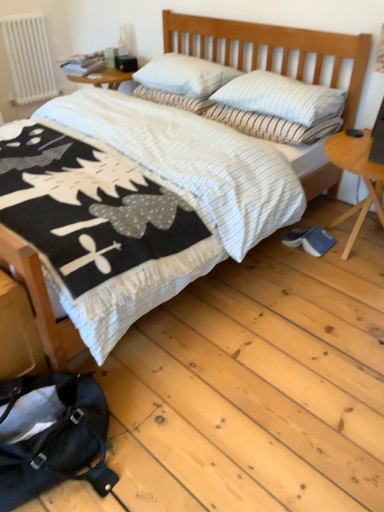
Question: In which direction should I rotate to look at white striped pillow at center, marked as the 1th pillow in a top-to-bottom arrangement?

Choices:
 (A) left
 (B) right

Answer: (A)

Question: Is white striped pillow at upper center, arranged as the third pillow when viewed from the top, positioned in front of white striped pillow at center, placed as the fourth pillow when sorted from bottom to top?

Choices:
 (A) yes
 (B) no

Answer: (A)

Question: Can you confirm if white striped pillow at upper center, arranged as the third pillow when viewed from the top, is positioned to the left of white striped pillow at center, placed as the fourth pillow when sorted from bottom to top?

Choices:
 (A) yes
 (B) no

Answer: (B)

Question: Is white striped pillow at upper center, which ranks as the second pillow in bottom-to-top order, smaller than white striped pillow at center, marked as the 1th pillow in a top-to-bottom arrangement?

Choices:
 (A) yes
 (B) no

Answer: (A)

Question: Is white striped pillow at upper center, which ranks as the second pillow in bottom-to-top order, looking in the opposite direction of white striped pillow at center, marked as the 1th pillow in a top-to-bottom arrangement?

Choices:
 (A) yes
 (B) no

Answer: (B)

Question: Is white striped pillow at upper center, which ranks as the second pillow in bottom-to-top order, taller than white striped pillow at center, placed as the fourth pillow when sorted from bottom to top?

Choices:
 (A) no
 (B) yes

Answer: (A)

Question: Can you confirm if white striped pillow at upper center, arranged as the third pillow when viewed from the top, is positioned to the right of white striped pillow at center, marked as the 1th pillow in a top-to-bottom arrangement?

Choices:
 (A) no
 (B) yes

Answer: (B)

Question: Is white quilted bed at center at the back of white striped pillow at upper center, the fourth pillow from the top?

Choices:
 (A) yes
 (B) no

Answer: (A)

Question: Is white striped pillow at upper center, the fourth pillow from the top, smaller than white quilted bed at center?

Choices:
 (A) no
 (B) yes

Answer: (B)

Question: Considering the relative positions of white striped pillow at upper center, the fourth pillow from the top, and white quilted bed at center in the image provided, is white striped pillow at upper center, the fourth pillow from the top, to the right of white quilted bed at center from the viewer's perspective?

Choices:
 (A) yes
 (B) no

Answer: (A)

Question: Is white striped pillow at upper center, the fourth pillow from the top, not inside white quilted bed at center?

Choices:
 (A) no
 (B) yes

Answer: (A)

Question: From the image's perspective, would you say white striped pillow at upper center, the fourth pillow from the top, is shown under white quilted bed at center?

Choices:
 (A) yes
 (B) no

Answer: (B)

Question: Are white striped pillow at upper center, the fourth pillow from the top, and white quilted bed at center beside each other?

Choices:
 (A) no
 (B) yes

Answer: (A)

Question: From a real-world perspective, is white striped pillow at center, the third pillow positioned from the bottom, on white striped pillow at center, placed as the fourth pillow when sorted from bottom to top?

Choices:
 (A) yes
 (B) no

Answer: (B)